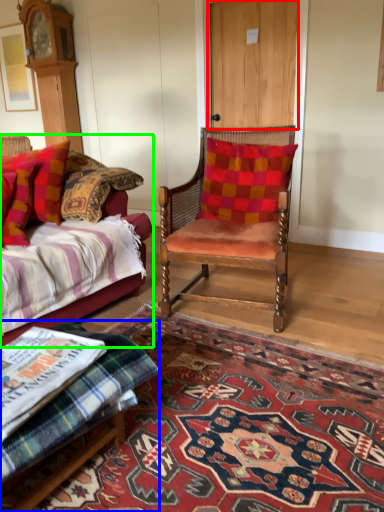
Question: Which object is the farthest from door (highlighted by a red box)? Choose among these: footrest (highlighted by a blue box) or studio couch (highlighted by a green box).

Choices:
 (A) footrest
 (B) studio couch

Answer: (A)